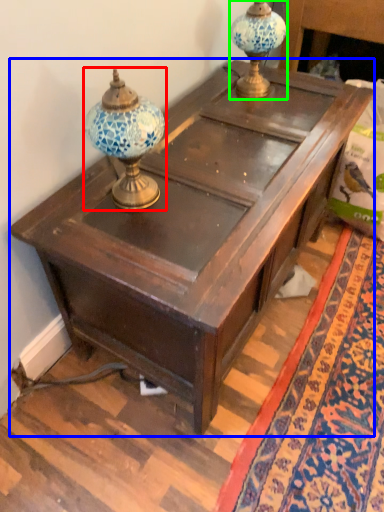
Question: Which object is the closest to the candle holder (highlighted by a red box)? Choose among these: table (highlighted by a blue box) or candle holder (highlighted by a green box).

Choices:
 (A) table
 (B) candle holder

Answer: (A)